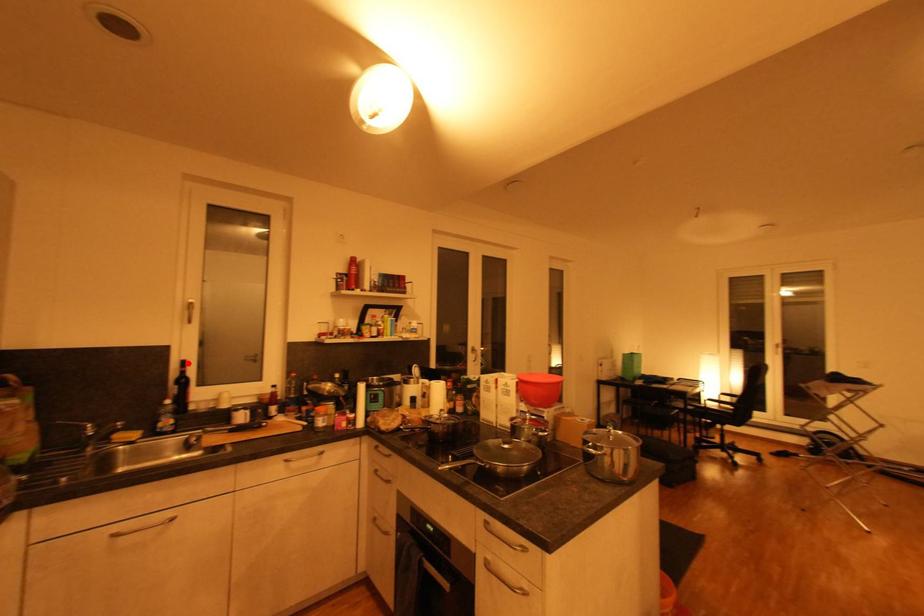
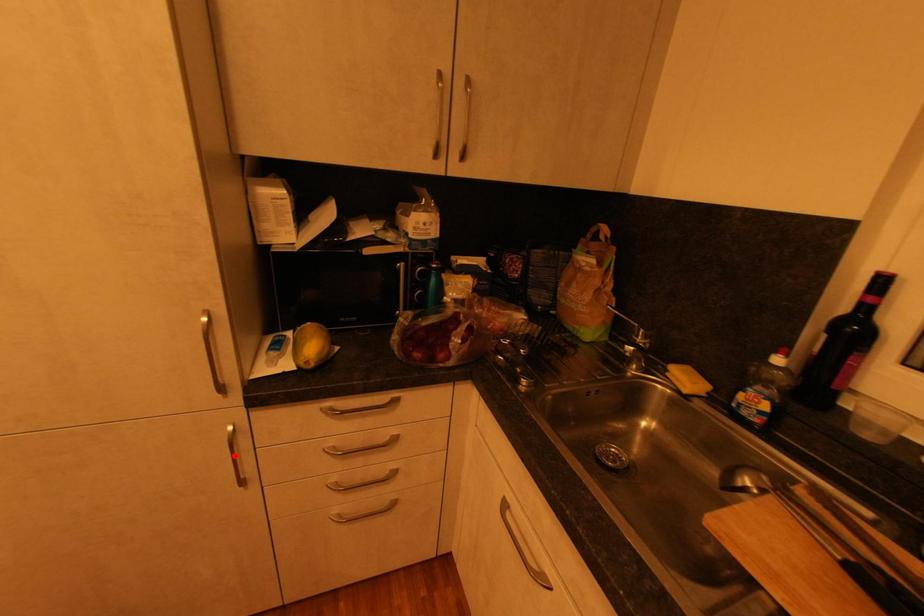
I am providing you with two images of the same scene from different viewpoints. A red point is marked on the first image and another point is marked on the second image. Is the marked point in image1 the same physical position as the marked point in image2?

No